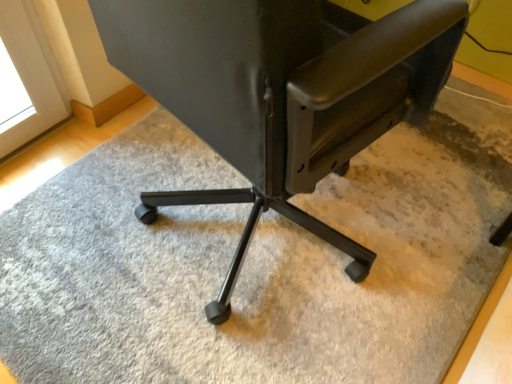
Where is `matte black chair at center`? The height and width of the screenshot is (384, 512). matte black chair at center is located at coordinates (281, 92).

Measure the distance between point (x=460, y=18) and camera.

The distance of point (x=460, y=18) from camera is 25.71 inches.

What is the approximate height of matte black chair at center?

matte black chair at center is 34.44 inches tall.

What do you see at coordinates (281, 92) in the screenshot? This screenshot has height=384, width=512. I see `matte black chair at center` at bounding box center [281, 92].

Where is `matte black chair at center`? matte black chair at center is located at coordinates (281, 92).